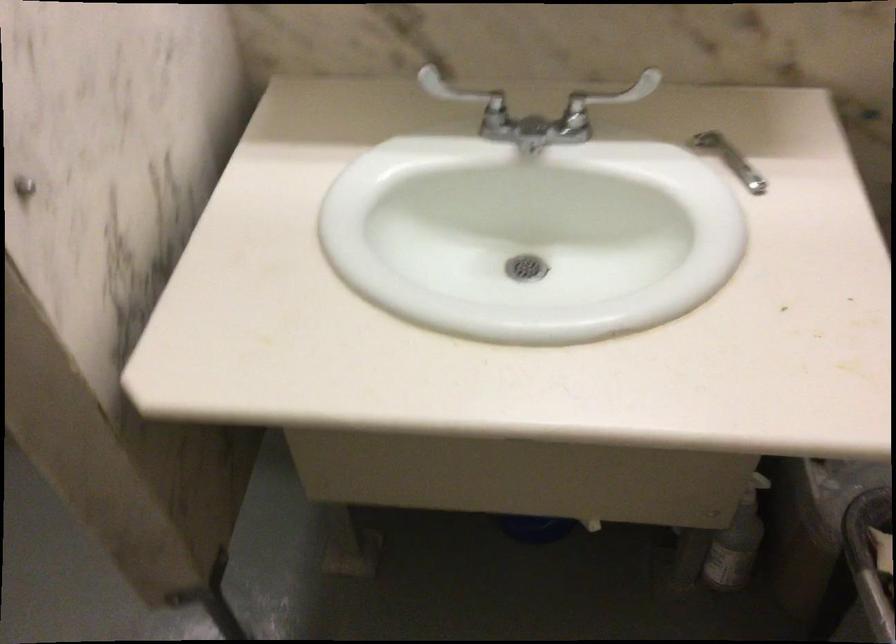
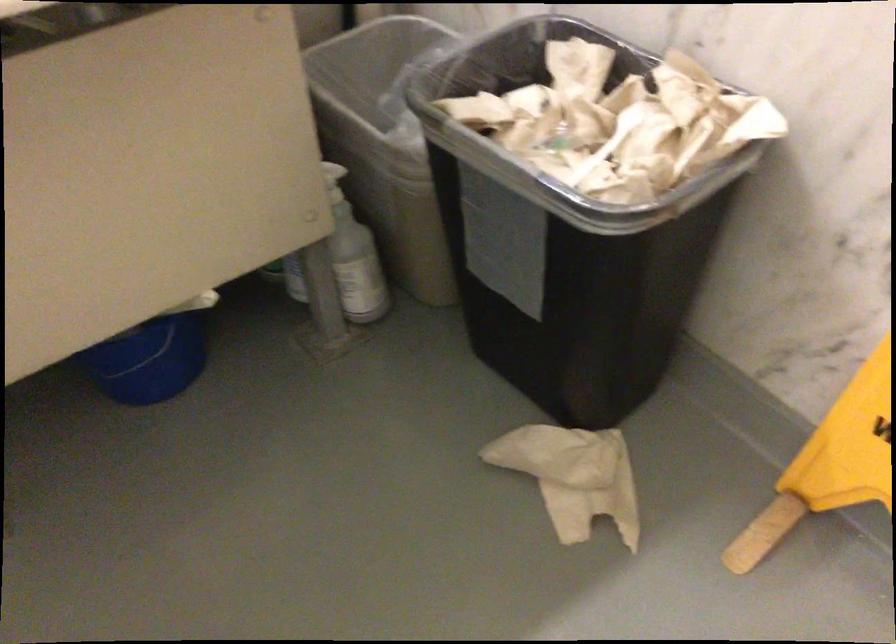
Question: The images are taken continuously from a first-person perspective. In which direction is your viewpoint rotating?

Choices:
 (A) Left
 (B) Right
 (C) Up
 (D) Down

Answer: (B)